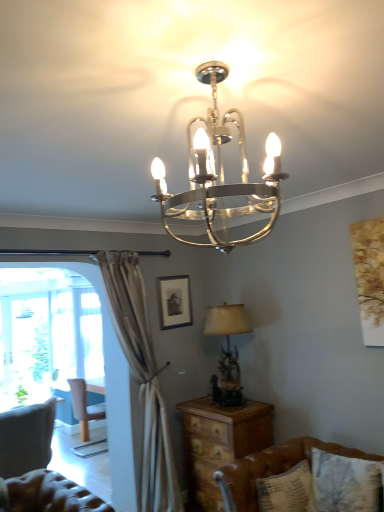
Question: Is polished metal chandelier at upper center, the 1th lamp from the top, in front of matte black picture frame at center?

Choices:
 (A) no
 (B) yes

Answer: (B)

Question: Considering the relative sizes of polished metal chandelier at upper center, the 1th lamp from the top, and matte black picture frame at center in the image provided, is polished metal chandelier at upper center, the 1th lamp from the top, bigger than matte black picture frame at center?

Choices:
 (A) yes
 (B) no

Answer: (A)

Question: Is polished metal chandelier at upper center, positioned as the second lamp in back-to-front order, far away from matte black picture frame at center?

Choices:
 (A) yes
 (B) no

Answer: (A)

Question: From a real-world perspective, is polished metal chandelier at upper center, which is counted as the first lamp, starting from the front, over matte black picture frame at center?

Choices:
 (A) no
 (B) yes

Answer: (B)

Question: Is polished metal chandelier at upper center, the 1th lamp from the top, turned away from matte black picture frame at center?

Choices:
 (A) no
 (B) yes

Answer: (A)

Question: Considering the relative sizes of polished metal chandelier at upper center, the 1th lamp from the top, and matte black picture frame at center in the image provided, is polished metal chandelier at upper center, the 1th lamp from the top, taller than matte black picture frame at center?

Choices:
 (A) no
 (B) yes

Answer: (B)

Question: From the image's perspective, does polished metal chandelier at upper center, acting as the 2th lamp starting from the bottom, appear lower than brown leather couch at lower right?

Choices:
 (A) no
 (B) yes

Answer: (A)

Question: From a real-world perspective, is polished metal chandelier at upper center, which is counted as the first lamp, starting from the front, positioned over brown leather couch at lower right based on gravity?

Choices:
 (A) yes
 (B) no

Answer: (A)

Question: Can we say polished metal chandelier at upper center, which is counted as the first lamp, starting from the front, lies outside brown leather couch at lower right?

Choices:
 (A) no
 (B) yes

Answer: (B)

Question: Can you confirm if polished metal chandelier at upper center, acting as the 2th lamp starting from the bottom, is wider than brown leather couch at lower right?

Choices:
 (A) yes
 (B) no

Answer: (B)

Question: From the image's perspective, would you say polished metal chandelier at upper center, which is counted as the first lamp, starting from the front, is positioned over brown leather couch at lower right?

Choices:
 (A) no
 (B) yes

Answer: (B)

Question: Can you confirm if polished metal chandelier at upper center, positioned as the second lamp in back-to-front order, is shorter than brown leather couch at lower right?

Choices:
 (A) no
 (B) yes

Answer: (B)

Question: Considering the relative sizes of brown leather couch at lower right and light brown wooden chair at left in the image provided, is brown leather couch at lower right shorter than light brown wooden chair at left?

Choices:
 (A) yes
 (B) no

Answer: (A)